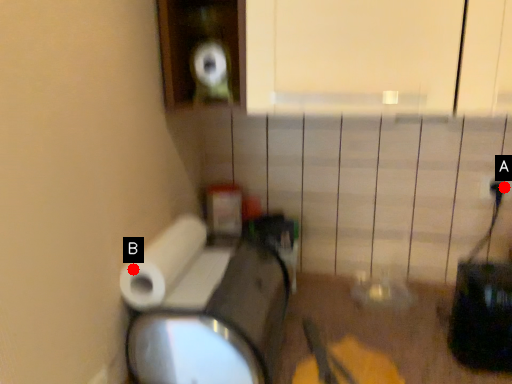
Question: Two points are circled on the image, labeled by A and B beside each circle. Which of the following is the closest to the observer?

Choices:
 (A) A is closer
 (B) B is closer

Answer: (B)